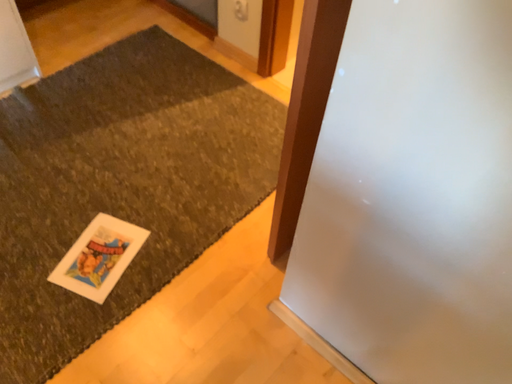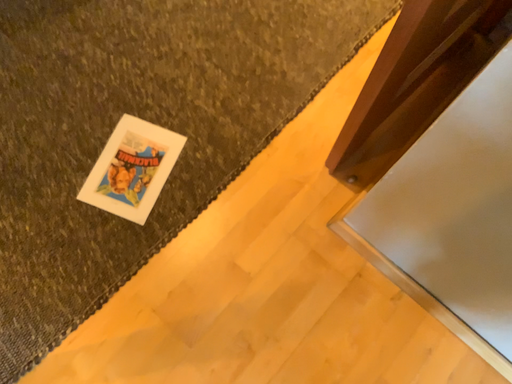
Question: Which way did the camera rotate in the video?

Choices:
 (A) rotated upward
 (B) rotated downward

Answer: (B)